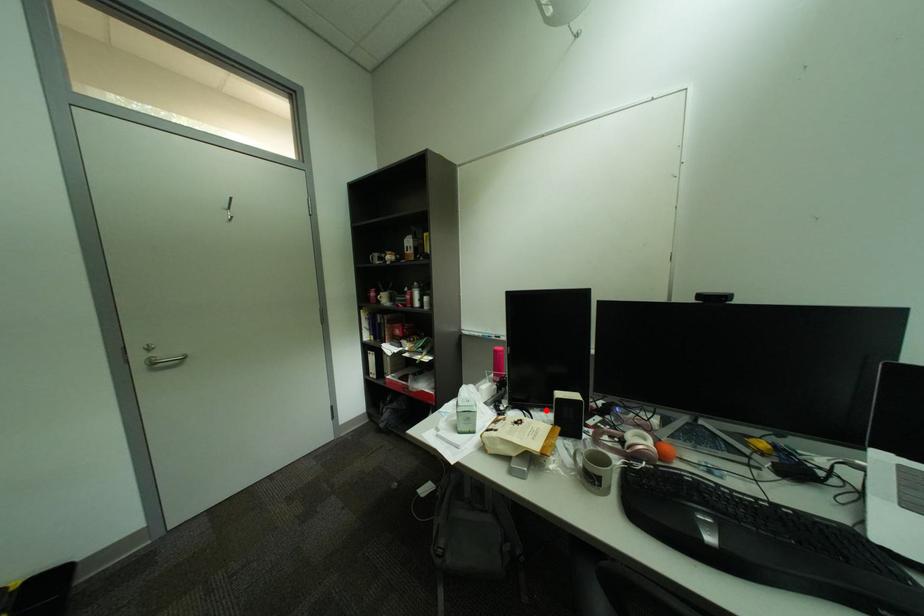
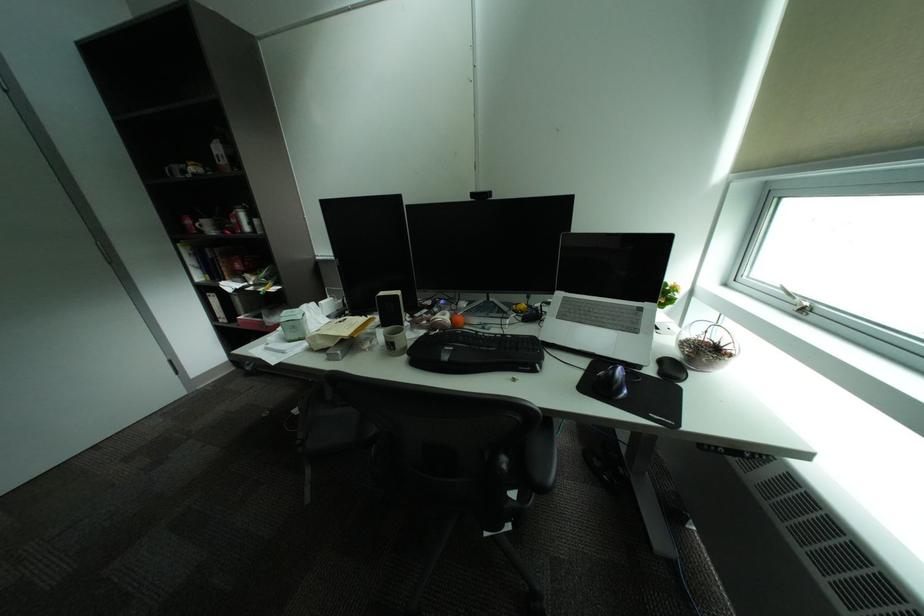
Locate, in the second image, the point that corresponds to the highlighted location in the first image.

(385, 314)